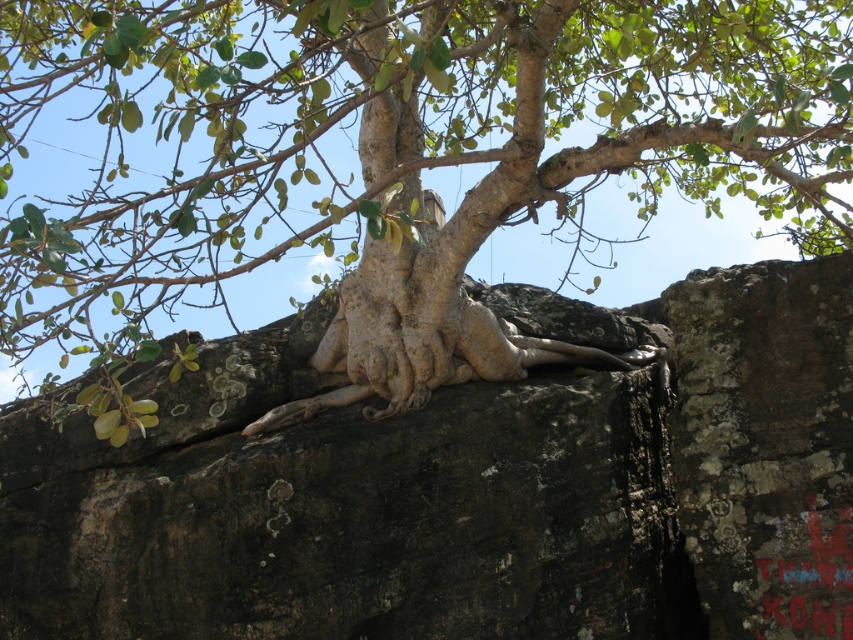
Does brown rough rock at center have a greater width compared to bark-like textured tree trunk at center?

Incorrect, brown rough rock at center's width does not surpass bark-like textured tree trunk at center's.

Is point (554, 298) positioned before point (190, 204)?

No, it is behind (190, 204).

Where is `brown rough rock at center`? The image size is (853, 640). brown rough rock at center is located at coordinates (463, 486).